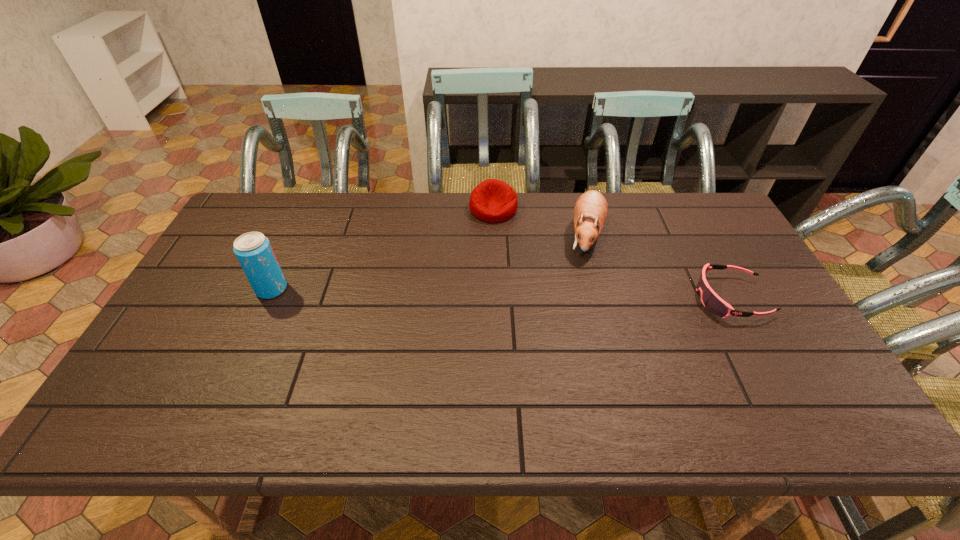
Where is `free region that satisfies the following two spatial constraints: 1. on the front side of the leftmost object; 2. on the front-facing side of the goggles`? free region that satisfies the following two spatial constraints: 1. on the front side of the leftmost object; 2. on the front-facing side of the goggles is located at coordinates [268, 298].

The width and height of the screenshot is (960, 540). In order to click on vacant area that satisfies the following two spatial constraints: 1. on the back side of the second tallest object; 2. on the left side of the soda can in this screenshot , I will do `click(297, 235)`.